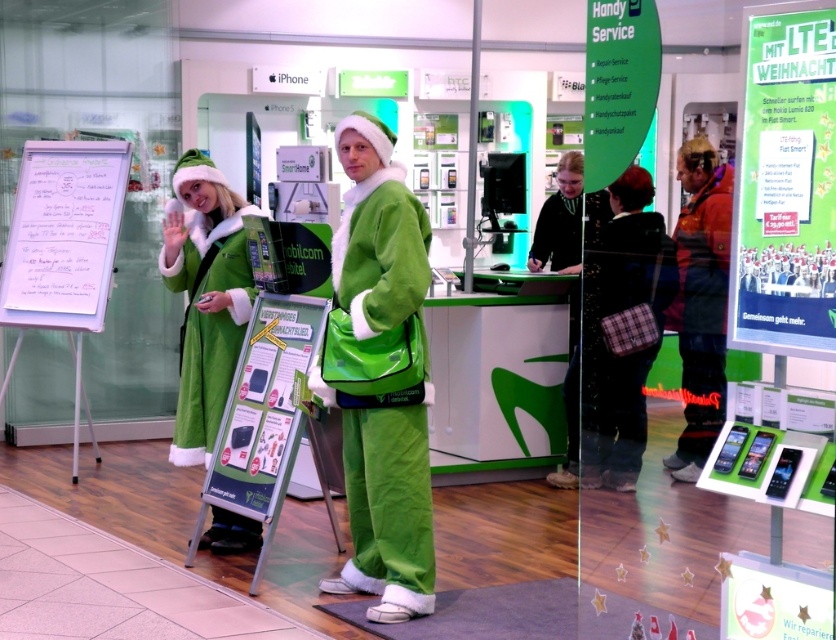
Question: Does plaid fabric purse at center appear on the right side of white paperboard at center?

Choices:
 (A) no
 (B) yes

Answer: (B)

Question: Which point is closer to the camera?

Choices:
 (A) plaid fabric purse at center
 (B) green fleece coat at left

Answer: (A)

Question: Is green fabric santa suit at center in front of green fleece santa hat at center?

Choices:
 (A) no
 (B) yes

Answer: (B)

Question: Is white paperboard at center closer to camera compared to orange fleece jacket at right?

Choices:
 (A) yes
 (B) no

Answer: (B)

Question: Which of the following is the closest to the observer?

Choices:
 (A) white paperboard at center
 (B) green fleece santa hat at center
 (C) orange fleece jacket at right

Answer: (C)

Question: Based on their relative distances, which object is nearer to the green fleece santa hat at center?

Choices:
 (A) green fabric santa suit at center
 (B) green fleece coat at left
 (C) plaid fabric purse at center

Answer: (A)